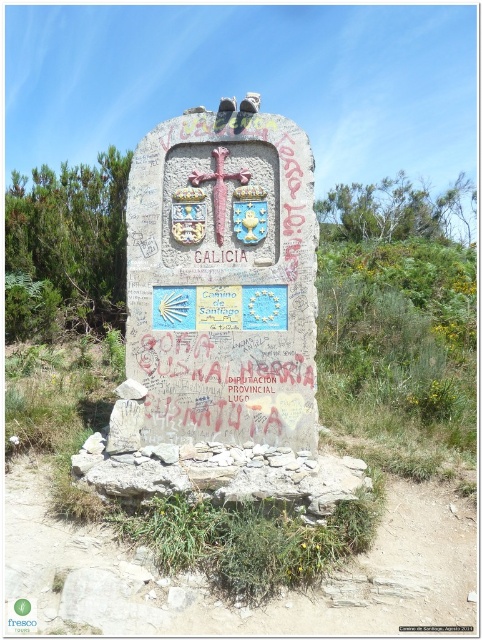
Question: Is stone plaque at center positioned at the back of polished wood cross at center?

Choices:
 (A) no
 (B) yes

Answer: (A)

Question: In this image, where is stone plaque at center located relative to polished wood cross at center?

Choices:
 (A) above
 (B) below

Answer: (B)

Question: Is stone plaque at center to the right of polished wood cross at center from the viewer's perspective?

Choices:
 (A) no
 (B) yes

Answer: (B)